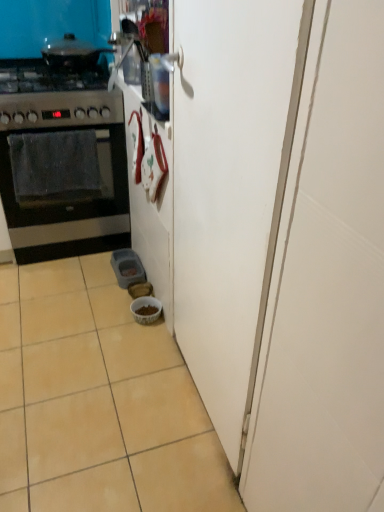
Question: From a real-world perspective, is shiny black pot at upper left above or below black matte oven at left?

Choices:
 (A) below
 (B) above

Answer: (B)

Question: From their relative heights in the image, would you say shiny black pot at upper left is taller or shorter than black matte oven at left?

Choices:
 (A) tall
 (B) short

Answer: (B)

Question: Based on their relative distances, which object is nearer to the white matte door at center?

Choices:
 (A) white glossy bowl at lower center
 (B) stainless steel gas stove at left
 (C) black matte oven at left
 (D) beige ceramic tile at lower left
 (E) shiny black pot at upper left

Answer: (D)

Question: Estimate the real-world distances between objects in this image. Which object is closer to the black matte oven at left?

Choices:
 (A) shiny black pot at upper left
 (B) white matte door at center
 (C) white glossy bowl at lower center
 (D) stainless steel gas stove at left
 (E) beige ceramic tile at lower left

Answer: (D)